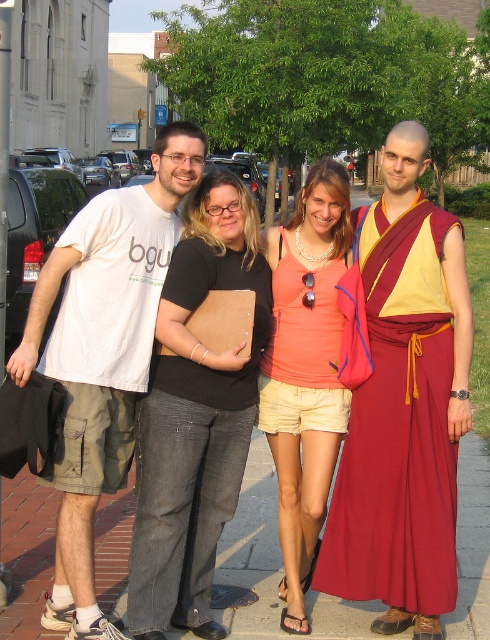
Question: Which of the following is the closest to the observer?

Choices:
 (A) (401, 355)
 (B) (307, 186)
 (C) (67, 266)

Answer: (C)

Question: Can you confirm if white t-shirt at left is wider than matte coral tank top at center?

Choices:
 (A) yes
 (B) no

Answer: (B)

Question: Estimate the real-world distances between objects in this image. Which object is farther from the matte coral tank top at center?

Choices:
 (A) brick pavement at lower center
 (B) maroon silk robe at center
 (C) white t-shirt at left
 (D) black cotton shirt at center

Answer: (C)

Question: Can you confirm if white t-shirt at left is smaller than matte coral tank top at center?

Choices:
 (A) no
 (B) yes

Answer: (B)

Question: Among these objects, which one is nearest to the camera?

Choices:
 (A) white t-shirt at left
 (B) matte coral tank top at center
 (C) black cotton shirt at center
 (D) brick pavement at lower center

Answer: (C)

Question: Can you confirm if black cotton shirt at center is thinner than matte coral tank top at center?

Choices:
 (A) yes
 (B) no

Answer: (B)